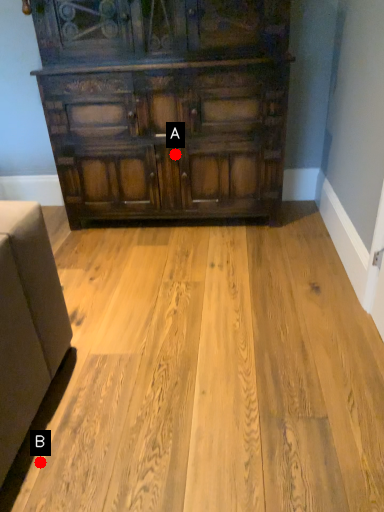
Question: Two points are circled on the image, labeled by A and B beside each circle. Which of the following is the closest to the observer?

Choices:
 (A) A is closer
 (B) B is closer

Answer: (B)